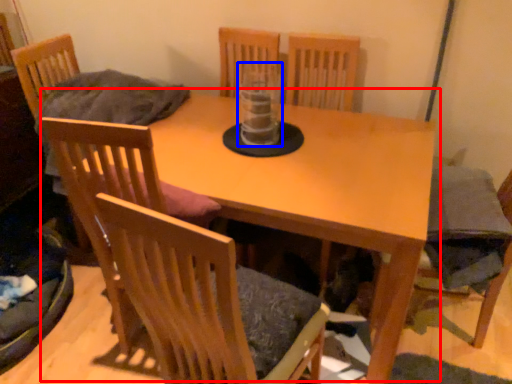
Question: Which object appears farthest to the camera in this image, table (highlighted by a red box) or glass vase (highlighted by a blue box)?

Choices:
 (A) table
 (B) glass vase

Answer: (B)